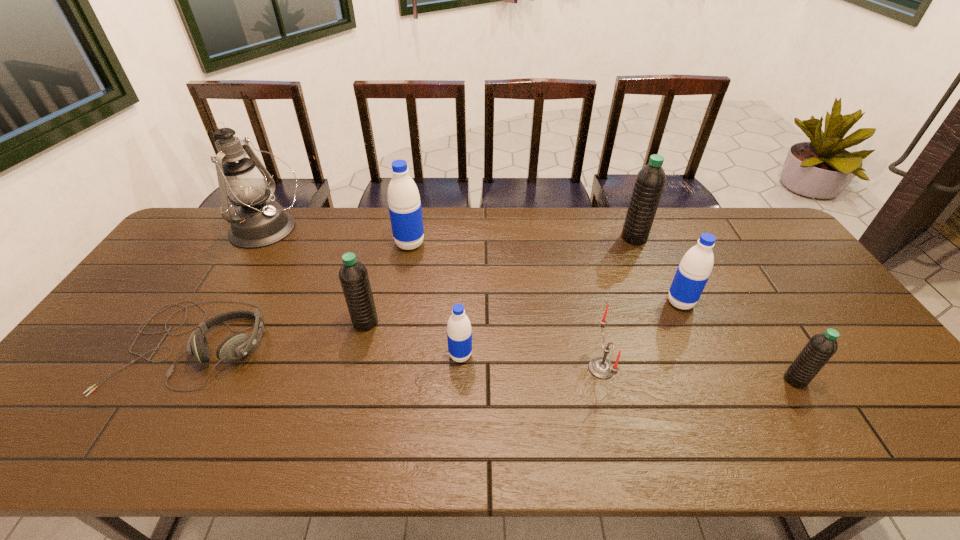
Find the location of `vacant area that lies between the smallest black water bottle and the candle`. vacant area that lies between the smallest black water bottle and the candle is located at coordinates (698, 374).

Find the location of a particular element. unoccupied position between the farthest blue water bottle and the rightmost water bottle is located at coordinates (603, 312).

Where is `free space that is in between the farthest blue water bottle and the second biggest black water bottle`? The height and width of the screenshot is (540, 960). free space that is in between the farthest blue water bottle and the second biggest black water bottle is located at coordinates (388, 283).

This screenshot has height=540, width=960. What are the coordinates of `free spot between the leftmost blue water bottle and the shortest object` in the screenshot? It's located at (302, 294).

This screenshot has height=540, width=960. I want to click on vacant space that's between the second biggest black water bottle and the shortest object, so click(x=280, y=333).

Identify which object is located as the fourth nearest to the shortest object. Please provide its 2D coordinates. Your answer should be formatted as a tuple, i.e. [(x, y)], where the tuple contains the x and y coordinates of a point satisfying the conditions above.

[(459, 334)]

Identify the location of object that is the sixth nearest to the nearest black water bottle. (404, 204).

Locate which water bottle ranks fifth in proximity to the headset. Please provide its 2D coordinates. Your answer should be formatted as a tuple, i.e. [(x, y)], where the tuple contains the x and y coordinates of a point satisfying the conditions above.

[(693, 272)]

Select which water bottle appears as the second closest to the rightmost blue water bottle. Please provide its 2D coordinates. Your answer should be formatted as a tuple, i.e. [(x, y)], where the tuple contains the x and y coordinates of a point satisfying the conditions above.

[(821, 347)]

Locate which blue water bottle is the third closest to the leftmost black water bottle. Please provide its 2D coordinates. Your answer should be formatted as a tuple, i.e. [(x, y)], where the tuple contains the x and y coordinates of a point satisfying the conditions above.

[(693, 272)]